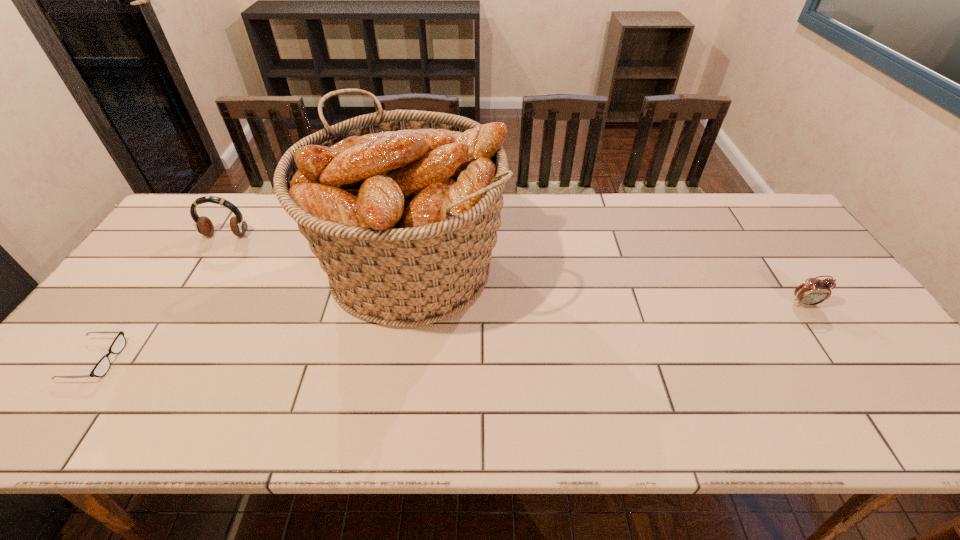
Locate an element on the screen. Image resolution: width=960 pixels, height=540 pixels. free space at the far left corner is located at coordinates (219, 234).

Locate an element on the screen. vacant region at the far right corner of the desktop is located at coordinates [x=777, y=218].

Locate an element on the screen. free space at the near right corner is located at coordinates (864, 415).

I want to click on free spot between the tallest object and the spectacles, so click(x=252, y=314).

At what (x,y) coordinates should I click in order to perform the action: click on empty space between the rightmost object and the second tallest object. Please return your answer as a coordinate pair (x, y). Looking at the image, I should click on (516, 270).

Locate an element on the screen. empty space between the rightmost object and the third shortest object is located at coordinates (516, 270).

Locate an element on the screen. This screenshot has height=540, width=960. vacant area that lies between the alarm clock and the second tallest object is located at coordinates (516, 270).

Where is `vacant area that lies between the alarm clock and the third shortest object`? Image resolution: width=960 pixels, height=540 pixels. vacant area that lies between the alarm clock and the third shortest object is located at coordinates (516, 270).

At what (x,y) coordinates should I click in order to perform the action: click on empty space between the shortest object and the tallest object. Please return your answer as a coordinate pair (x, y). This screenshot has height=540, width=960. Looking at the image, I should click on (252, 314).

Find the location of a particular element. vacant area between the basket and the shortest object is located at coordinates 252,314.